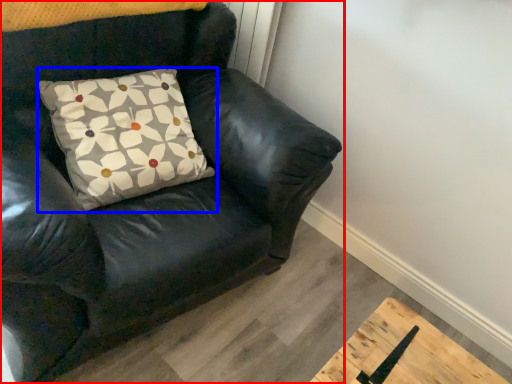
Question: Which object appears farthest to the camera in this image, chair (highlighted by a red box) or pillow (highlighted by a blue box)?

Choices:
 (A) chair
 (B) pillow

Answer: (B)